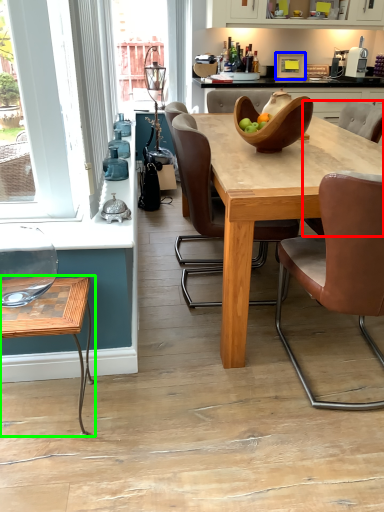
Question: Based on their relative distances, which object is farther from chair (highlighted by a red box)? Choose from appliance (highlighted by a blue box) and coffee table (highlighted by a green box).

Choices:
 (A) appliance
 (B) coffee table

Answer: (B)